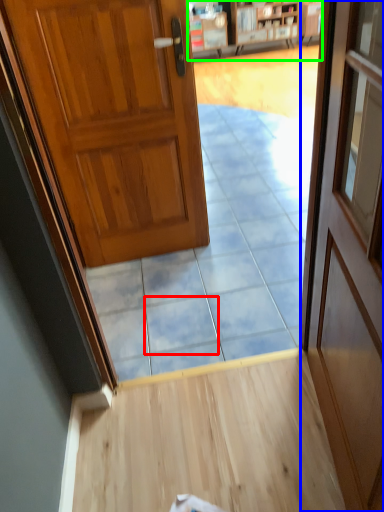
Question: Which object is positioned farthest from tile (highlighted by a red box)? Select from door (highlighted by a blue box) and bookshelf (highlighted by a green box).

Choices:
 (A) door
 (B) bookshelf

Answer: (B)